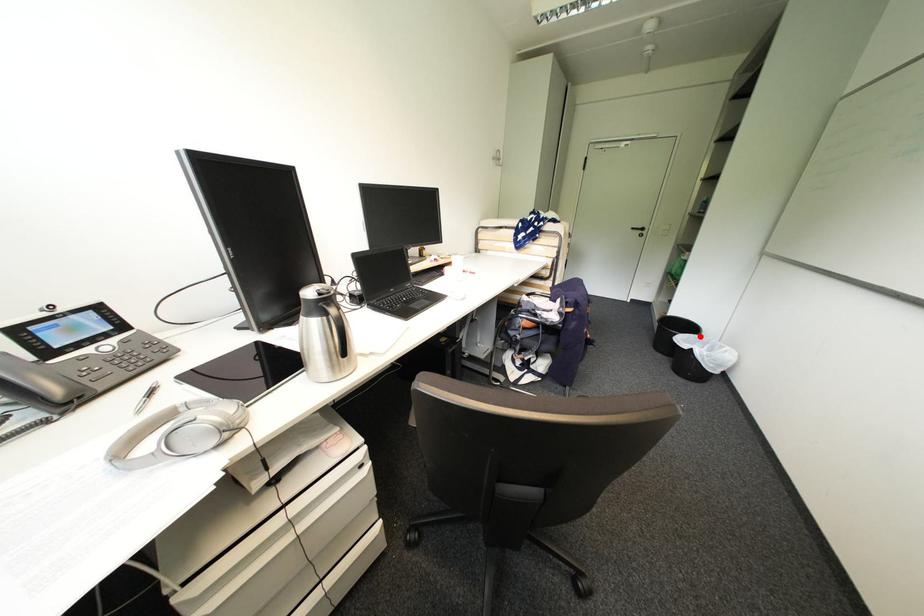
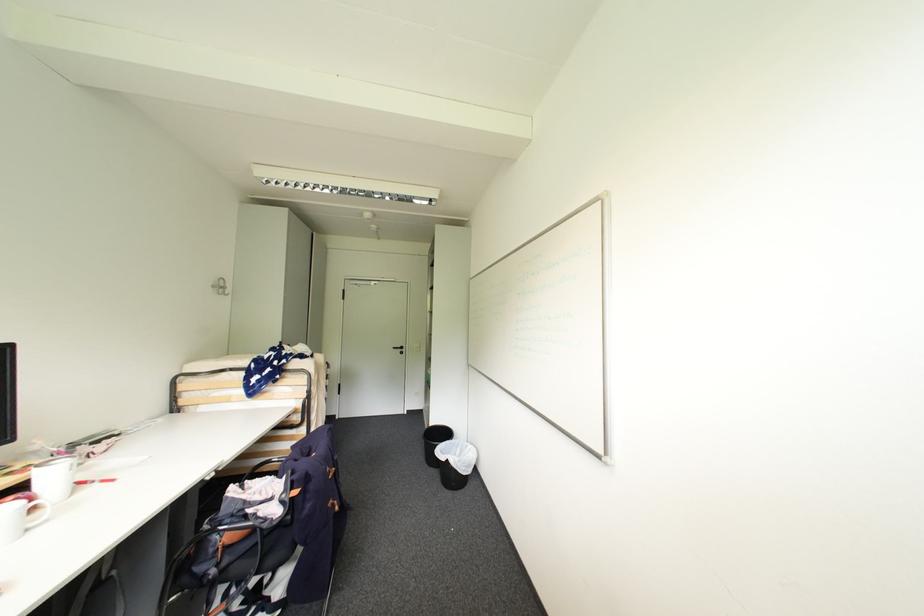
The point at the highlighted location is marked in the first image. Where is the corresponding point in the second image?

(456, 442)